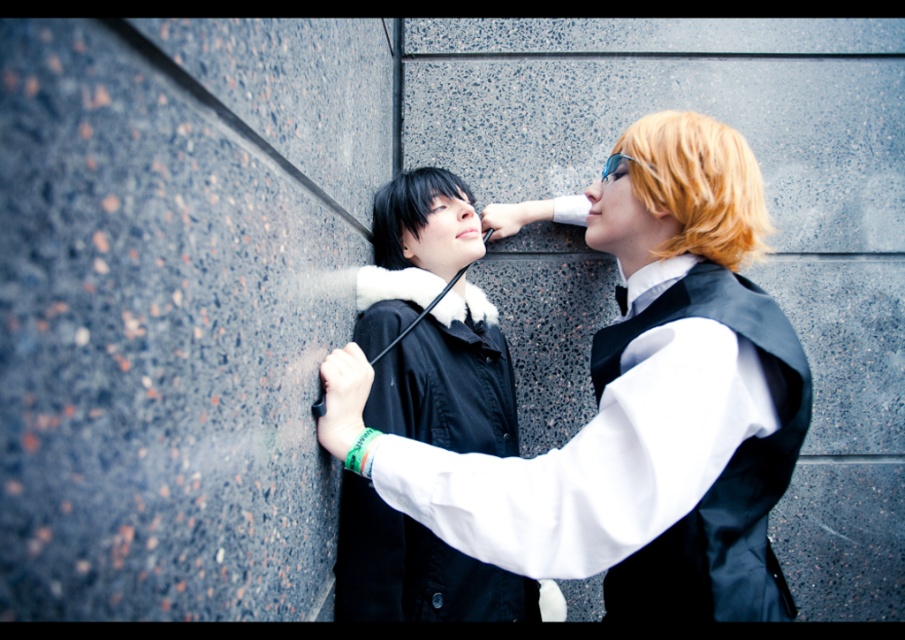
You are a photographer using a camera with a focal length of 50mm. You want to take a sharp photo of the matte black jacket at center while keeping the textured wall in focus. Given that the minimum focusing distance for your camera at this setting is 30 inches, will you be able to achieve this?

The matte black jacket at center is 30.11 inches away from camera. Since the minimum focusing distance is 30 inches, the camera can focus at 30.11 inches, so yes, you can take a sharp photo of the matte black jacket at center while keeping the textured wall in focus.

You are a photographer adjusting your camera settings to capture the scene. You notice the matte black jacket at center and the black matte hair at center. Which object should you focus on first if you want to ensure both are in sharp focus, considering their positions?

The matte black jacket at center is positioned under the black matte hair at center, so focusing on the black matte hair at center first will ensure it stays in focus while the jacket below it also remains sharp.